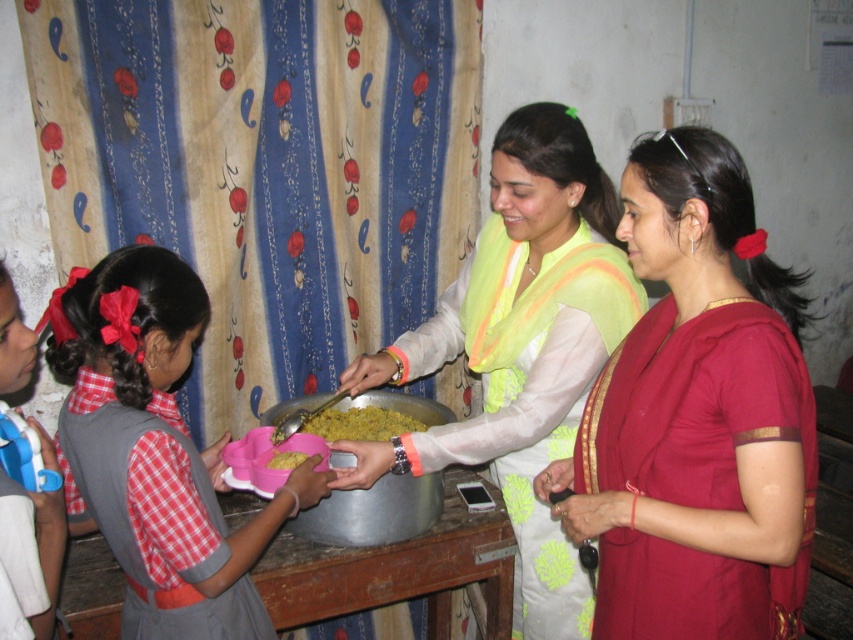
Between red plaid dress at lower left and yellow matte rice at center, which one appears on the right side from the viewer's perspective?

yellow matte rice at center

Which is behind, point (247, 531) or point (325, 404)?

Point (325, 404)

What are the coordinates of `red plaid dress at lower left` in the screenshot? It's located at (155, 451).

Between red plaid dress at lower left and pink plastic tray at center, which one is positioned higher?

red plaid dress at lower left is higher up.

Does red plaid dress at lower left appear under pink plastic tray at center?

Actually, red plaid dress at lower left is above pink plastic tray at center.

Is point (65, 408) more distant than point (399, 493)?

No, it is not.

Where is `red plaid dress at lower left`? This screenshot has height=640, width=853. red plaid dress at lower left is located at coordinates (155, 451).

Which is above, light green silk saree at center or pink plastic tray at center?

Positioned higher is light green silk saree at center.

Does light green silk saree at center have a smaller size compared to pink plastic tray at center?

Actually, light green silk saree at center might be larger than pink plastic tray at center.

At what (x,y) coordinates should I click in order to perform the action: click on light green silk saree at center. Please return your answer as a coordinate pair (x, y). This screenshot has height=640, width=853. Looking at the image, I should click on tap(520, 348).